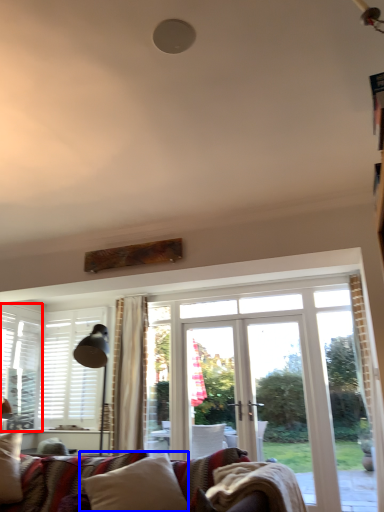
Question: Which object is closer to the camera taking this photo, window (highlighted by a red box) or pillow (highlighted by a blue box)?

Choices:
 (A) window
 (B) pillow

Answer: (B)